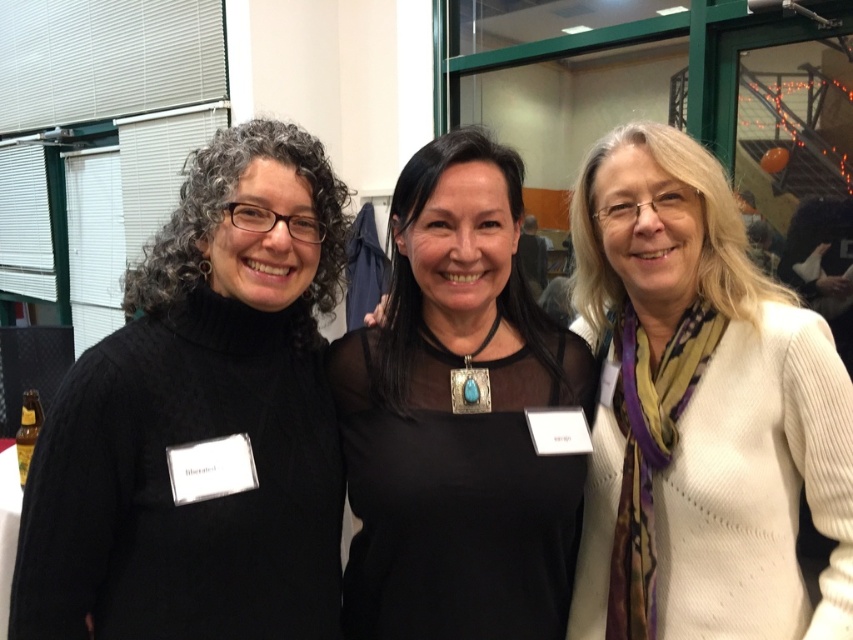
Who is taller, black sweater at left or black mesh top at center?

black mesh top at center

Is black sweater at left above black mesh top at center?

Yes.

Who is more distant from viewer, [254,397] or [374,436]?

Positioned behind is point [374,436].

Identify the location of black sweater at left. (201, 419).

Describe the element at coordinates (201, 419) in the screenshot. I see `black sweater at left` at that location.

Is black sweater at left behind white ribbed sweater at center?

That is False.

Locate an element on the screen. This screenshot has height=640, width=853. black sweater at left is located at coordinates (201, 419).

You are a GUI agent. You are given a task and a screenshot of the screen. Output one action in this format:
    pyautogui.click(x=<x>, y=<y>)
    Task: Click on the white ribbed sweater at center
    
    Given the screenshot: What is the action you would take?
    pyautogui.click(x=700, y=412)

Which is in front, point (785, 442) or point (585, 355)?

Point (785, 442)

Where is `white ribbed sweater at center`? The width and height of the screenshot is (853, 640). white ribbed sweater at center is located at coordinates (700, 412).